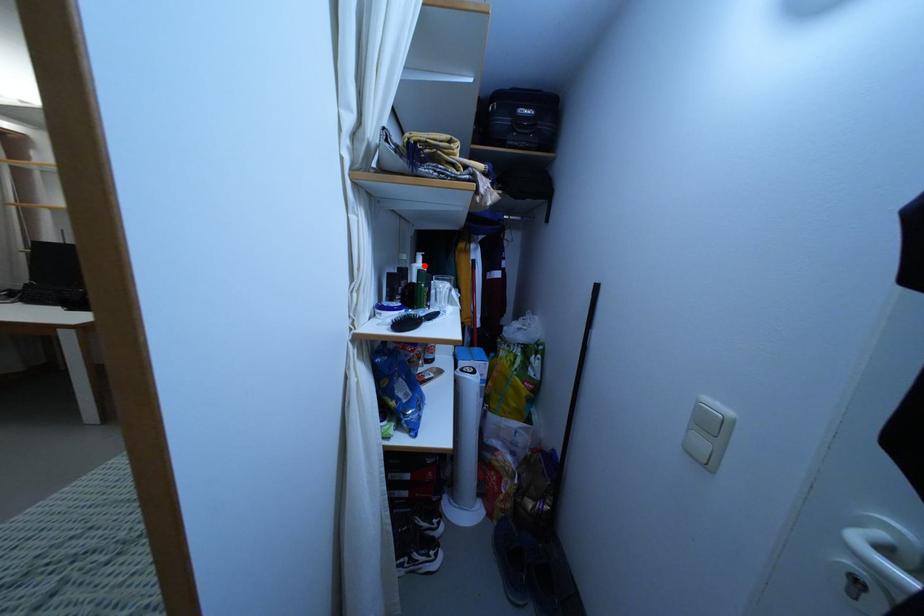
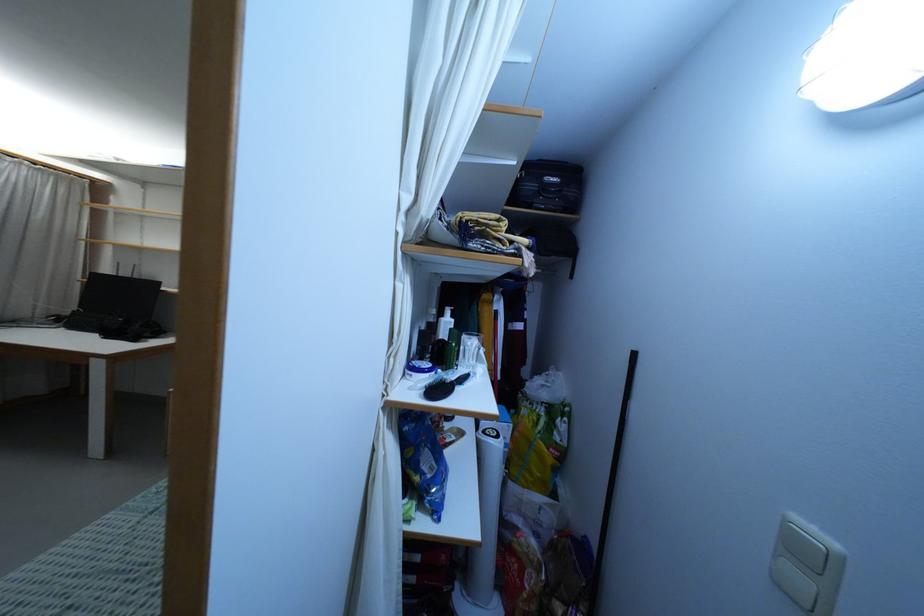
In the second image, find the point that corresponds to the highlighted location in the first image.

(453, 320)